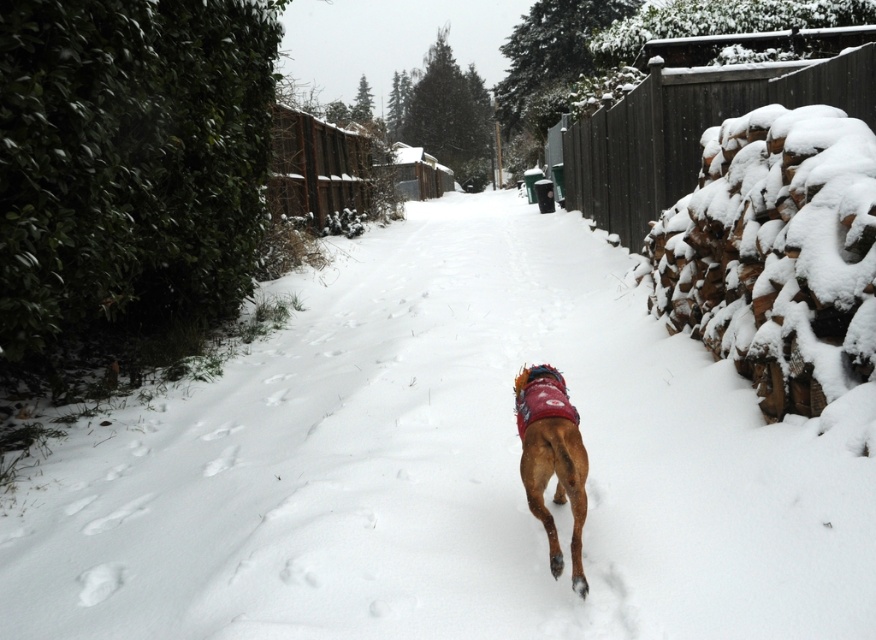
Question: Considering the real-world distances, which object is farthest from the white fluffy snow at center?

Choices:
 (A) dark brown wooden fence at upper right
 (B) brown furry dog at center

Answer: (A)

Question: Which object is closer to the camera taking this photo?

Choices:
 (A) white fluffy snow at center
 (B) dark brown wooden fence at upper right

Answer: (A)

Question: Is white fluffy snow at center above dark brown wooden fence at upper right?

Choices:
 (A) yes
 (B) no

Answer: (B)

Question: Can you confirm if dark brown wooden fence at upper right is bigger than brown furry dog at center?

Choices:
 (A) yes
 (B) no

Answer: (A)

Question: Estimate the real-world distances between objects in this image. Which object is farther from the brown furry dog at center?

Choices:
 (A) dark brown wooden fence at upper right
 (B) white fluffy snow at center

Answer: (A)

Question: Is white fluffy snow at center to the left of dark brown wooden fence at upper right from the viewer's perspective?

Choices:
 (A) no
 (B) yes

Answer: (B)